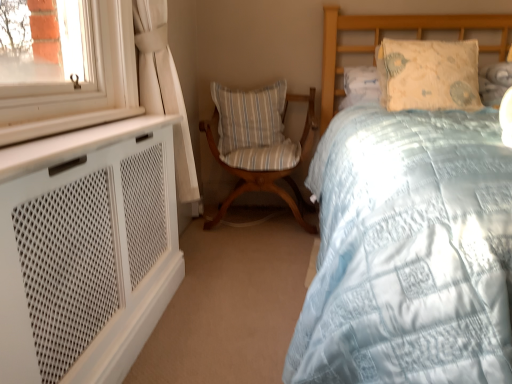
Question: Should I look upward or downward to see woodenchair at center?

Choices:
 (A) down
 (B) up

Answer: (B)

Question: Is light blue quilted pillow at upper right, placed as the 1th pillow when sorted from right to left, thinner than light blue quilted bed at center?

Choices:
 (A) yes
 (B) no

Answer: (A)

Question: Is light blue quilted pillow at upper right, which is the 1th pillow in front-to-back order, shorter than light blue quilted bed at center?

Choices:
 (A) yes
 (B) no

Answer: (A)

Question: Is light blue quilted pillow at upper right, positioned as the 2th pillow in left-to-right order, outside of light blue quilted bed at center?

Choices:
 (A) yes
 (B) no

Answer: (B)

Question: From the image's perspective, does light blue quilted pillow at upper right, placed as the 1th pillow when sorted from right to left, appear lower than light blue quilted bed at center?

Choices:
 (A) yes
 (B) no

Answer: (B)

Question: Does light blue quilted pillow at upper right, the second pillow viewed from the back, have a smaller size compared to light blue quilted bed at center?

Choices:
 (A) yes
 (B) no

Answer: (A)

Question: Can you confirm if light blue quilted pillow at upper right, which is the 1th pillow in front-to-back order, is wider than light blue quilted bed at center?

Choices:
 (A) yes
 (B) no

Answer: (B)

Question: From a real-world perspective, is woodenchair at center below light blue quilted pillow at upper right, placed as the 1th pillow when sorted from right to left?

Choices:
 (A) yes
 (B) no

Answer: (A)

Question: Is light blue quilted pillow at upper right, which is the 1th pillow in front-to-back order, inside woodenchair at center?

Choices:
 (A) yes
 (B) no

Answer: (B)

Question: Could you tell me if woodenchair at center is facing light blue quilted pillow at upper right, positioned as the 2th pillow in left-to-right order?

Choices:
 (A) no
 (B) yes

Answer: (A)

Question: Considering the relative sizes of woodenchair at center and light blue quilted pillow at upper right, the second pillow viewed from the back, in the image provided, is woodenchair at center smaller than light blue quilted pillow at upper right, the second pillow viewed from the back,?

Choices:
 (A) no
 (B) yes

Answer: (A)

Question: Is woodenchair at center shorter than light blue quilted pillow at upper right, which is the 1th pillow in front-to-back order?

Choices:
 (A) yes
 (B) no

Answer: (B)

Question: From the image's perspective, is woodenchair at center under light blue quilted pillow at upper right, which is the 1th pillow in front-to-back order?

Choices:
 (A) no
 (B) yes

Answer: (B)

Question: Does striped fabric pillow at center, the 2th pillow when ordered from right to left, lie in front of light blue quilted bed at center?

Choices:
 (A) no
 (B) yes

Answer: (A)